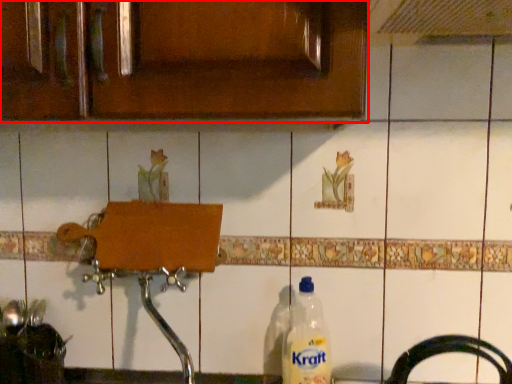
Question: From the image's perspective, considering the relative positions of cabinetry (annotated by the red box) and bottle in the image provided, where is cabinetry (annotated by the red box) located with respect to the staircase?

Choices:
 (A) above
 (B) below

Answer: (A)